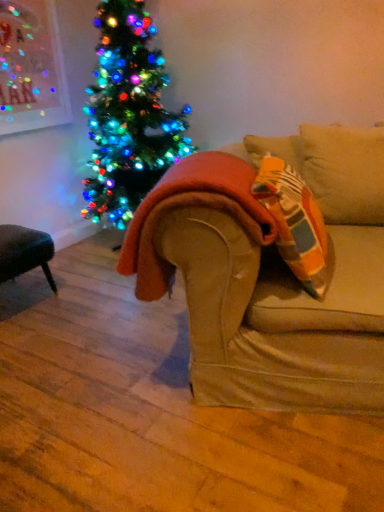
Question: Is the position of orange fuzzy blanket at center more distant than that of orange fabric pillow at right?

Choices:
 (A) yes
 (B) no

Answer: (A)

Question: From a real-world perspective, does orange fuzzy blanket at center sit lower than orange fabric pillow at right?

Choices:
 (A) yes
 (B) no

Answer: (A)

Question: Is orange fuzzy blanket at center outside of orange fabric pillow at right?

Choices:
 (A) yes
 (B) no

Answer: (A)

Question: From the image's perspective, does orange fuzzy blanket at center appear lower than orange fabric pillow at right?

Choices:
 (A) no
 (B) yes

Answer: (B)

Question: Is orange fuzzy blanket at center beside orange fabric pillow at right?

Choices:
 (A) yes
 (B) no

Answer: (B)

Question: Is orange fuzzy blanket at center facing away from orange fabric pillow at right?

Choices:
 (A) yes
 (B) no

Answer: (B)

Question: From the image's perspective, is orange fabric pillow at right under orange fuzzy blanket at center?

Choices:
 (A) no
 (B) yes

Answer: (A)

Question: Considering the relative positions of orange fabric pillow at right and orange fuzzy blanket at center in the image provided, is orange fabric pillow at right in front of orange fuzzy blanket at center?

Choices:
 (A) no
 (B) yes

Answer: (B)

Question: Can you confirm if orange fabric pillow at right is positioned to the left of orange fuzzy blanket at center?

Choices:
 (A) yes
 (B) no

Answer: (B)

Question: Is orange fabric pillow at right oriented away from orange fuzzy blanket at center?

Choices:
 (A) no
 (B) yes

Answer: (B)

Question: Is orange fabric pillow at right taller than orange fuzzy blanket at center?

Choices:
 (A) no
 (B) yes

Answer: (B)

Question: Is orange fabric pillow at right far from orange fuzzy blanket at center?

Choices:
 (A) no
 (B) yes

Answer: (A)

Question: Is orange fabric pillow at right in front of or behind orange fuzzy blanket at center in the image?

Choices:
 (A) behind
 (B) front

Answer: (B)